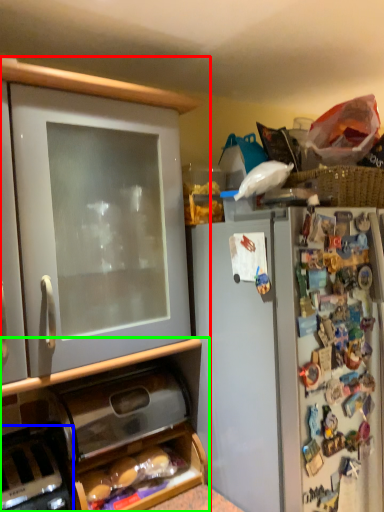
Question: Based on their relative distances, which object is farther from cabinetry (highlighted by a red box)? Choose from appliance (highlighted by a blue box) and cabinetry (highlighted by a green box).

Choices:
 (A) appliance
 (B) cabinetry

Answer: (A)